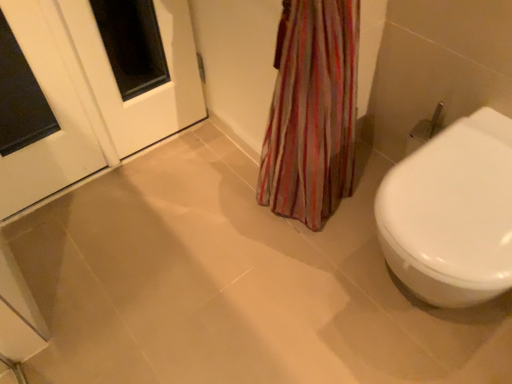
Find the location of a particular element. The width and height of the screenshot is (512, 384). vacant area situated to the left side of white glossy bidet at right is located at coordinates (302, 299).